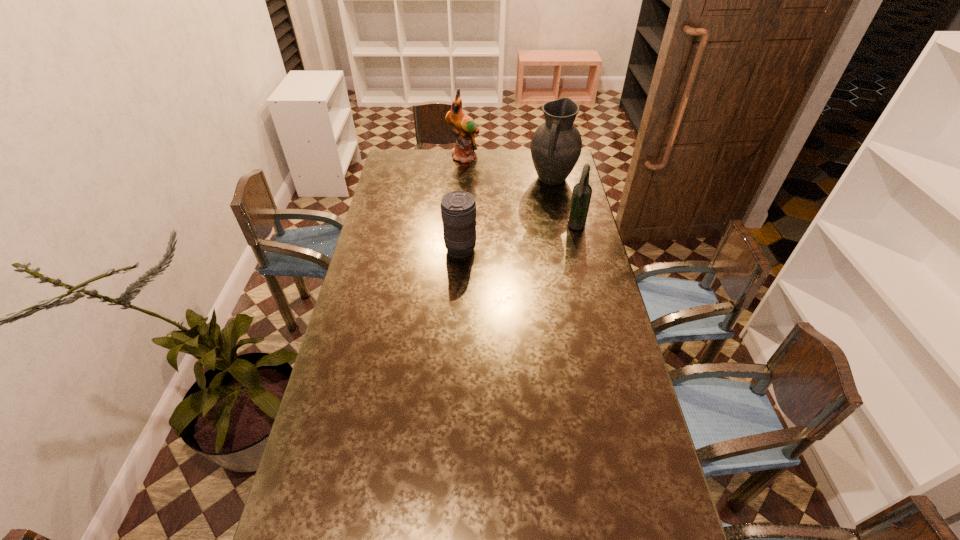
Image resolution: width=960 pixels, height=540 pixels. Find the location of `free spot between the nearest object and the second nearest object`. free spot between the nearest object and the second nearest object is located at coordinates (518, 239).

Find the location of `empty space that is in between the nearest object and the third farthest object`. empty space that is in between the nearest object and the third farthest object is located at coordinates (518, 239).

Where is `unoccupied area between the farthest object and the pitcher`? unoccupied area between the farthest object and the pitcher is located at coordinates (508, 168).

This screenshot has width=960, height=540. In order to click on free spot between the beer bottle and the pitcher in this screenshot , I will do `click(564, 203)`.

I want to click on blank region between the third nearest object and the telephoto lens, so click(x=506, y=214).

Identify the location of the second closest object to the telephoto lens. (556, 145).

Locate an element on the screen. object identified as the second closest to the second nearest object is located at coordinates (458, 208).

At what (x,y) coordinates should I click in order to perform the action: click on vacant position in the image that satisfies the following two spatial constraints: 1. on the front side of the parrot; 2. on the left side of the third farthest object. Please return your answer as a coordinate pair (x, y). Image resolution: width=960 pixels, height=540 pixels. Looking at the image, I should click on (460, 227).

Image resolution: width=960 pixels, height=540 pixels. I want to click on vacant space that satisfies the following two spatial constraints: 1. on the front side of the third nearest object; 2. on the right side of the farthest object, so click(463, 179).